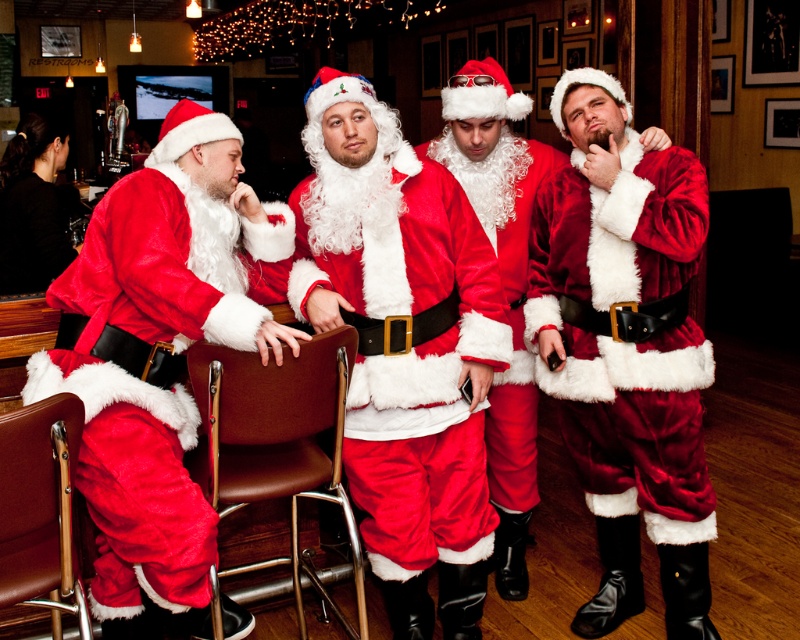
You are a photographer trying to capture a group photo of the fuzzy red santa suit at left and the velvet santa suit at center. The camera you have can only focus on objects within a 3 feet range. Can you take a photo of both of them at the same time without moving the camera?

The fuzzy red santa suit at left is 3.31 feet from the velvet santa suit at center, which is slightly beyond the camera focus range of 3 feet. Therefore, you cannot take a photo of both at the same time without moving the camera.

You are a photographer setting up for a group photo. You need to position yourself so that you can capture both the fuzzy red santa suit at left and the velvet santa suit at center in the same frame. Based on their positions, which side should you stand to ensure both are visible?

You should stand to the right side of the velvet santa suit at center to include both the fuzzy red santa suit at left and the velvet santa suit at center in the frame since the fuzzy red santa suit at left is positioned to the left of the velvet santa suit at center.

You are a photographer at the bar and want to take a photo of both the fuzzy red santa suit at left and the velvet santa suit at center. Which one is closer to the camera?

The fuzzy red santa suit at left is closer to the camera because it is in front of the velvet santa suit at center.